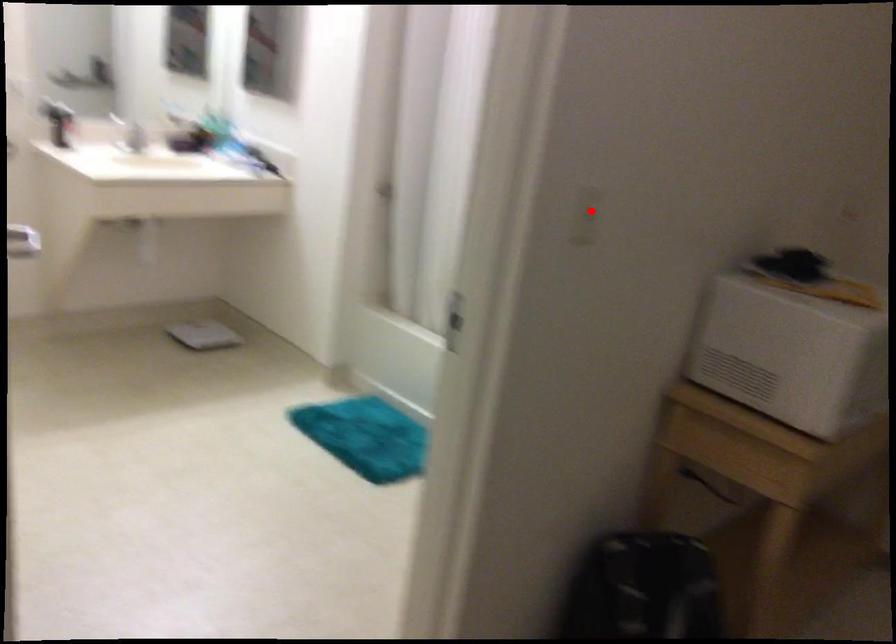
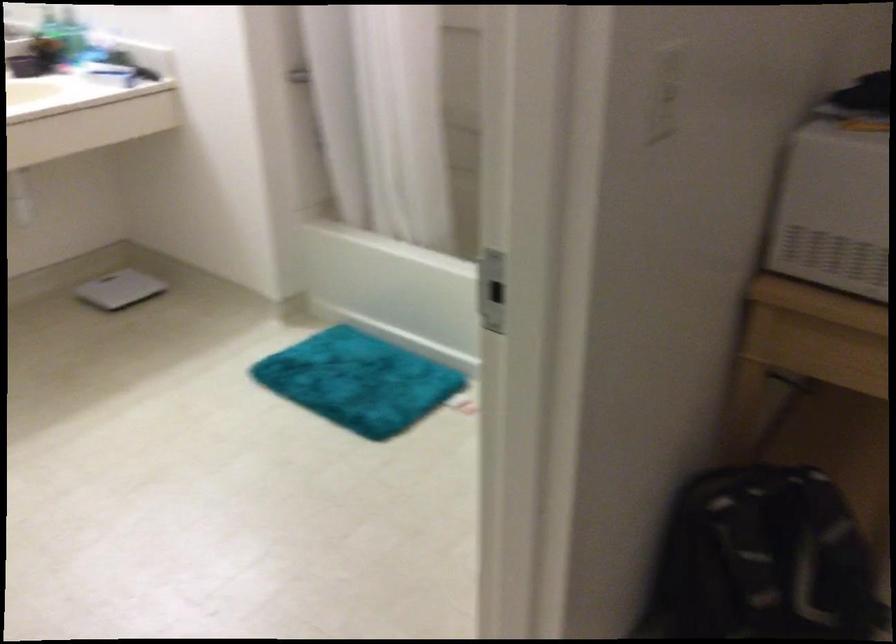
In the second image, find the point that corresponds to the highlighted location in the first image.

(666, 93)